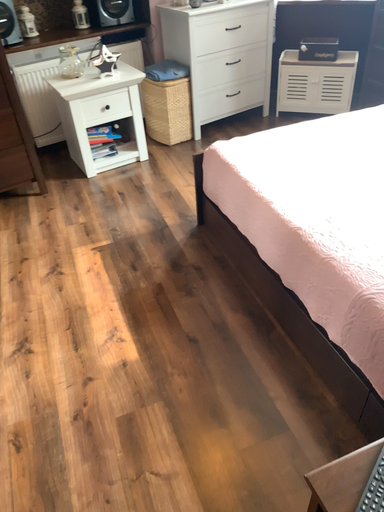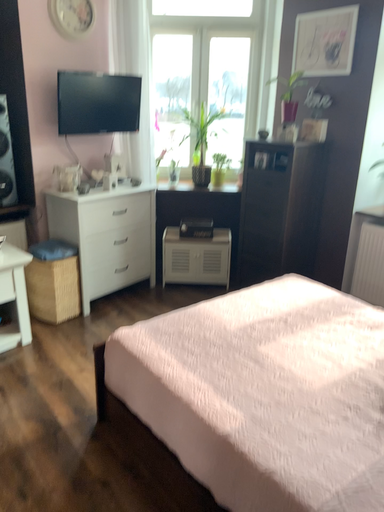
Question: How did the camera likely rotate when shooting the video?

Choices:
 (A) rotated left
 (B) rotated right

Answer: (B)